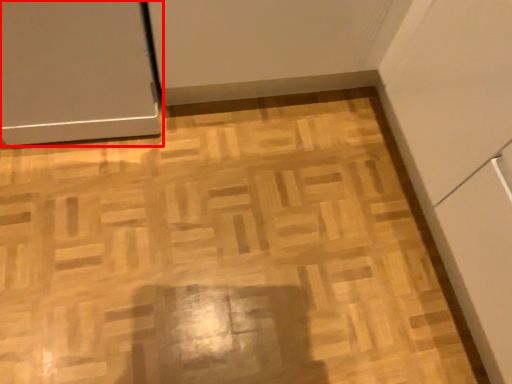
Question: From the image, what is the correct spatial relationship of door (annotated by the red box) in relation to plywood?

Choices:
 (A) left
 (B) right

Answer: (A)